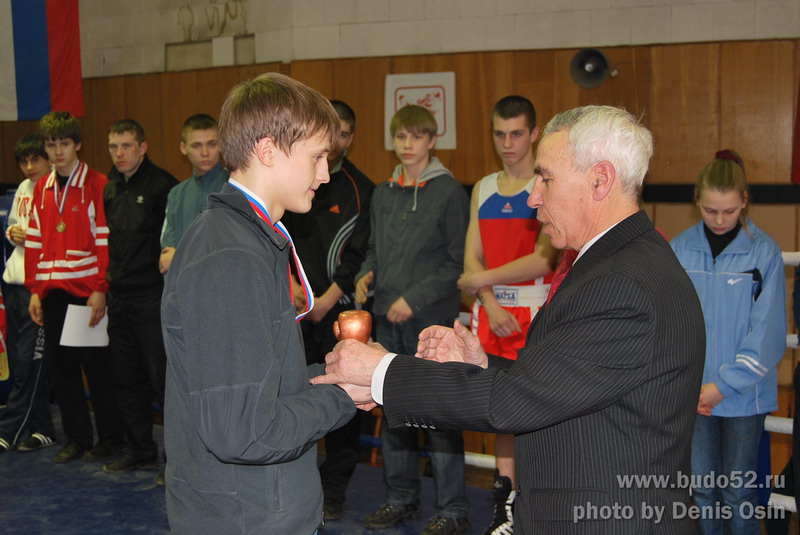
Locate an element on the screen. paneling is located at coordinates (157, 106).